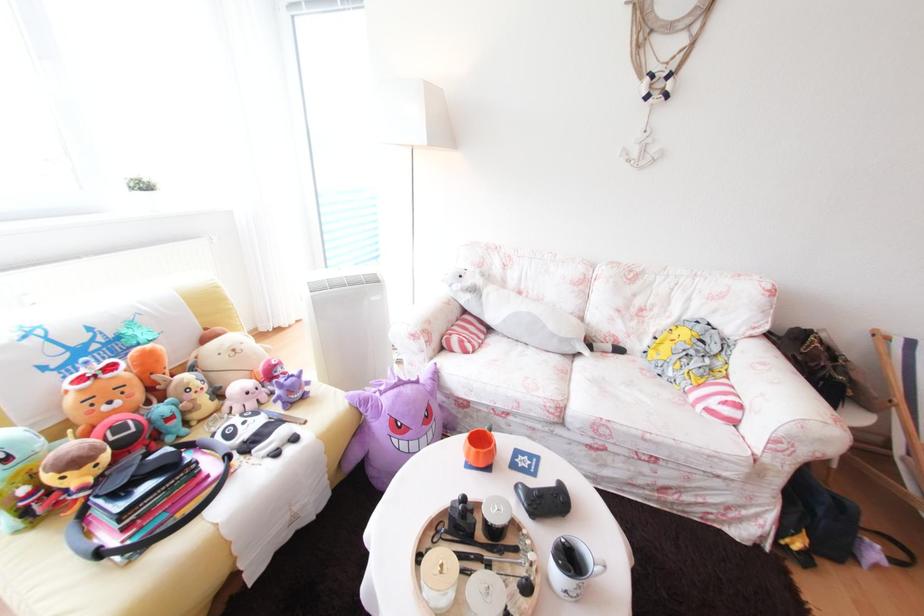
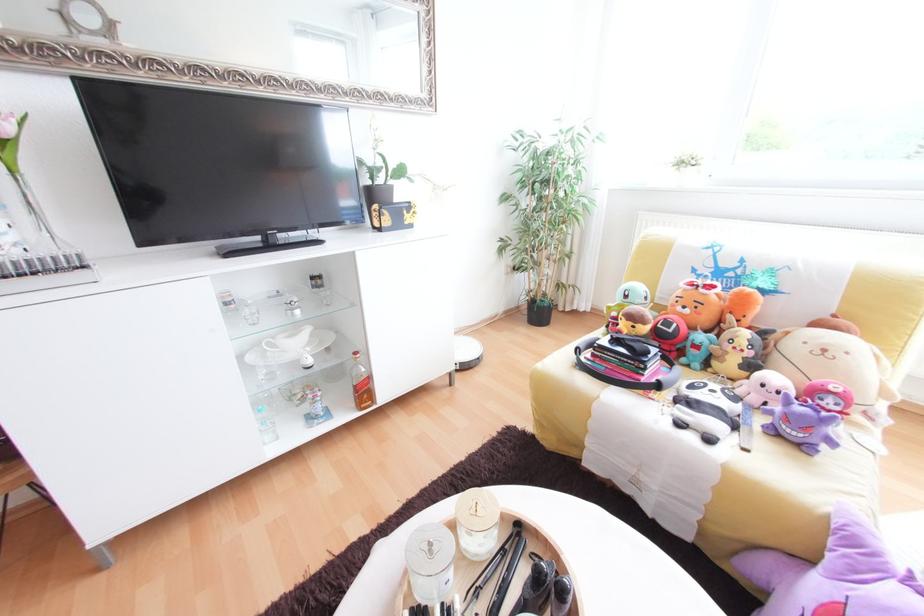
Locate, in the second image, the point that corresponds to [119,368] in the first image.

(719, 288)